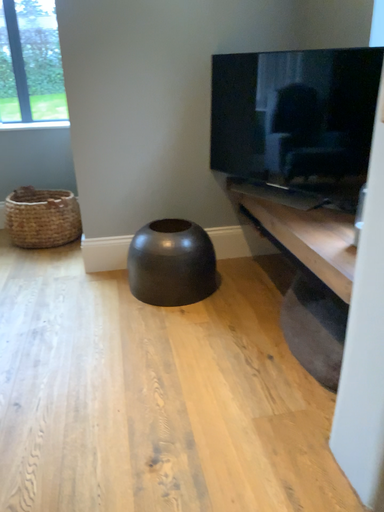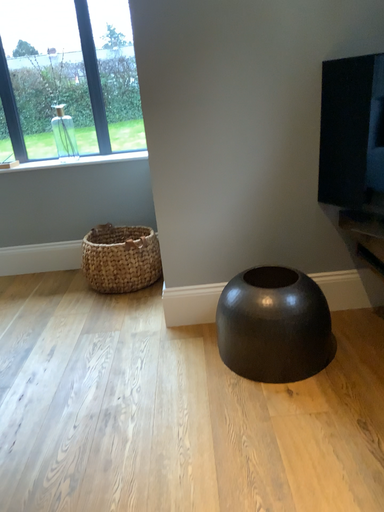
Question: How did the camera likely rotate when shooting the video?

Choices:
 (A) rotated left
 (B) rotated right

Answer: (A)